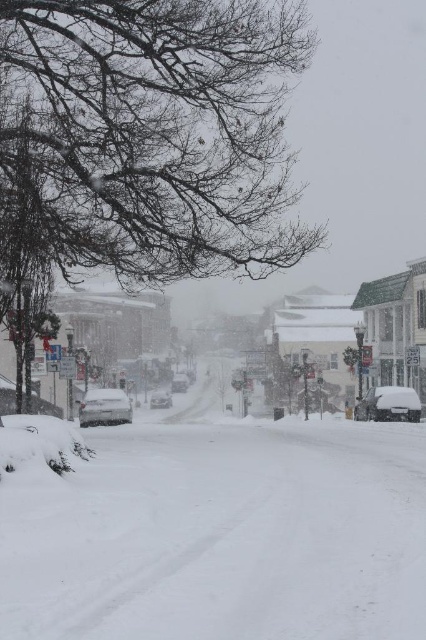
Does point (218, 356) come closer to viewer compared to point (183, 372)?

No.

Identify the location of white snow-covered town at center. (333, 342).

Is point (244, 596) farther from camera compared to point (370, 381)?

No, (244, 596) is in front of (370, 381).

Does white powdery snow at center have a greater height compared to white snow-covered town at center?

No.

Measure the distance between point (46,624) and camera.

Point (46,624) is 5.69 meters away from camera.

You are a GUI agent. You are given a task and a screenshot of the screen. Output one action in this format:
    pyautogui.click(x=<x>, y=<y>)
    Task: Click on the white powdery snow at center
    The height and width of the screenshot is (640, 426).
    Given the screenshot: What is the action you would take?
    (221, 536)

Is white matte car at right bigger than silver metallic sedan at center?

Indeed, white matte car at right has a larger size compared to silver metallic sedan at center.

This screenshot has height=640, width=426. What do you see at coordinates (388, 404) in the screenshot?
I see `white matte car at right` at bounding box center [388, 404].

Locate an element on the screen. The width and height of the screenshot is (426, 640). white matte car at right is located at coordinates (388, 404).